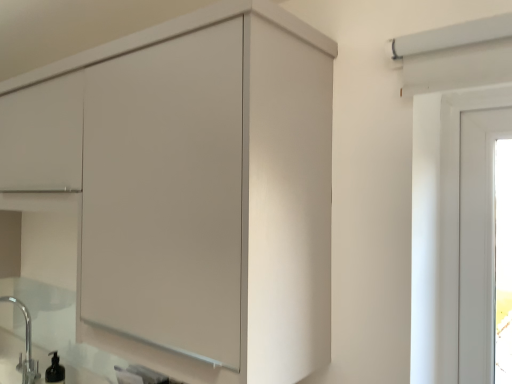
Question: Is satin nickel faucet at lower left wider or thinner than matte white cupboard at center?

Choices:
 (A) thin
 (B) wide

Answer: (A)

Question: Based on their positions, is satin nickel faucet at lower left located to the left or right of matte white cupboard at center?

Choices:
 (A) right
 (B) left

Answer: (B)

Question: Relative to matte white cupboard at center, is satin nickel faucet at lower left in front or behind?

Choices:
 (A) behind
 (B) front

Answer: (A)

Question: In the image, is matte white cupboard at center positioned in front of or behind satin nickel faucet at lower left?

Choices:
 (A) behind
 (B) front

Answer: (B)

Question: From a real-world perspective, is matte white cupboard at center positioned above or below satin nickel faucet at lower left?

Choices:
 (A) above
 (B) below

Answer: (A)

Question: Considering the positions of point (80, 104) and point (3, 299), is point (80, 104) closer or farther from the camera than point (3, 299)?

Choices:
 (A) farther
 (B) closer

Answer: (B)

Question: Considering the positions of matte white cupboard at center and satin nickel faucet at lower left in the image, is matte white cupboard at center wider or thinner than satin nickel faucet at lower left?

Choices:
 (A) wide
 (B) thin

Answer: (A)